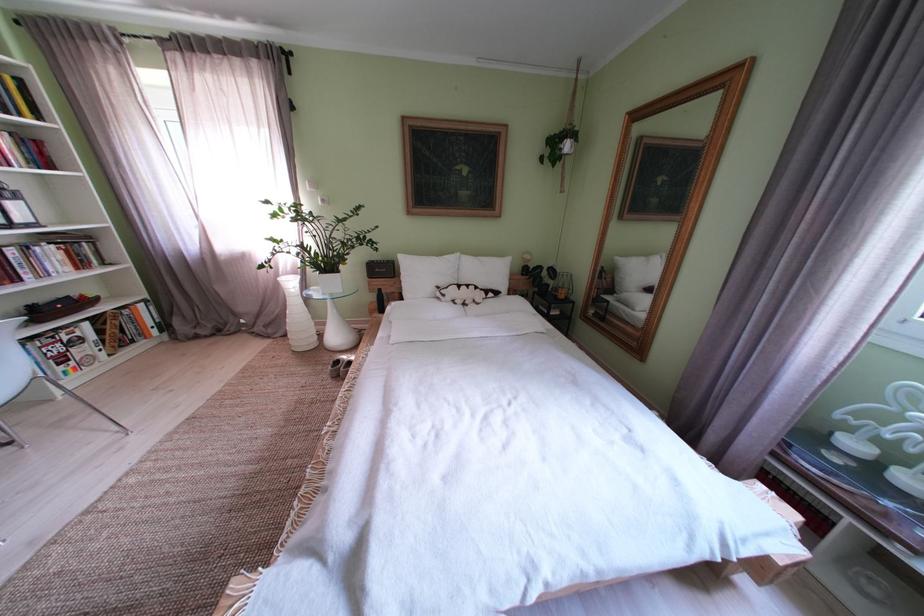
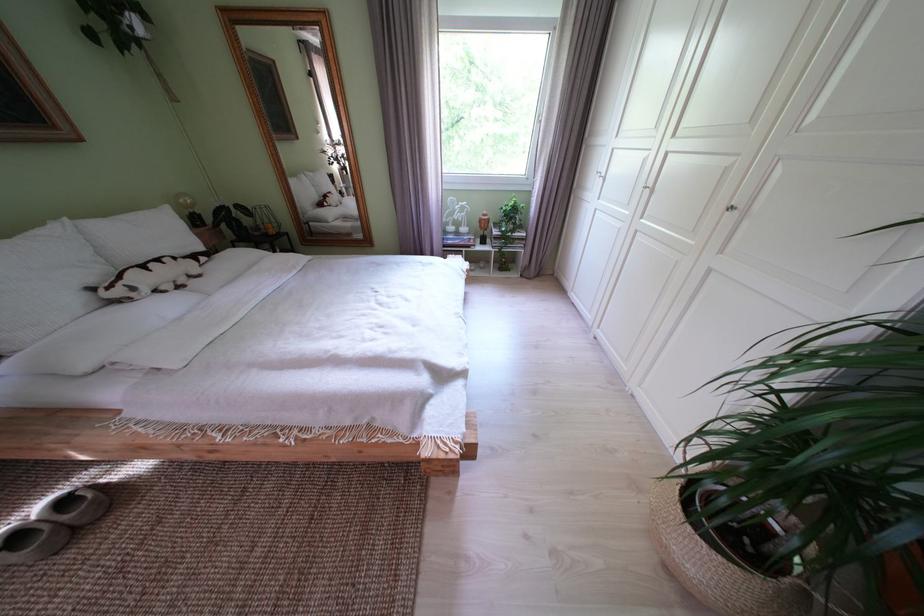
Find the pixel in the second image that matches (766,426) in the first image.

(445, 241)